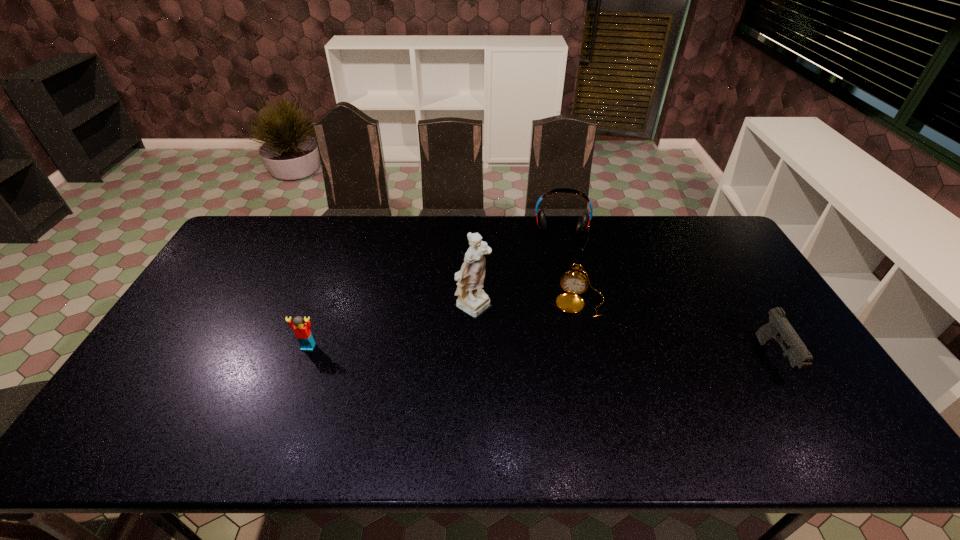
This screenshot has width=960, height=540. I want to click on object that is at the right edge, so tap(778, 328).

Where is `object located at the near right corner`? This screenshot has width=960, height=540. object located at the near right corner is located at coordinates (778, 328).

Locate an element on the screen. free space at the far edge of the desktop is located at coordinates (499, 250).

In the image, there is a desktop. Where is `vacant space at the near edge`? This screenshot has height=540, width=960. vacant space at the near edge is located at coordinates (586, 407).

You are a GUI agent. You are given a task and a screenshot of the screen. Output one action in this format:
    pyautogui.click(x=<x>, y=<y>)
    Task: Click on the vacant area at the left edge of the desktop
    Image resolution: width=960 pixels, height=540 pixels.
    Given the screenshot: What is the action you would take?
    pyautogui.click(x=205, y=309)

This screenshot has width=960, height=540. In the image, there is a desktop. Identify the location of free space at the far left corner. (276, 232).

This screenshot has width=960, height=540. Identify the location of vacant space at the far right corner. (698, 220).

You are a GUI agent. You are given a task and a screenshot of the screen. Output one action in this format:
    pyautogui.click(x=<x>, y=<y>)
    Task: Click on the free point between the leftmost object and the tallest object
    
    Given the screenshot: What is the action you would take?
    pyautogui.click(x=393, y=327)

Locate an element on the screen. Image resolution: width=960 pixels, height=540 pixels. vacant space that's between the pocket watch and the rightmost object is located at coordinates (677, 331).

You are a GUI agent. You are given a task and a screenshot of the screen. Output one action in this format:
    pyautogui.click(x=<x>, y=<y>)
    Task: Click on the free space between the leftmost object and the second object from left to right
    The height and width of the screenshot is (540, 960).
    Given the screenshot: What is the action you would take?
    pyautogui.click(x=393, y=327)